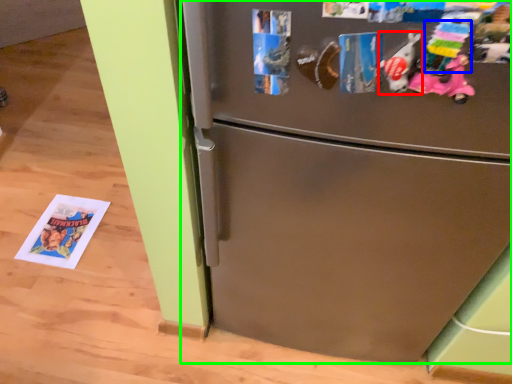
Question: Which object is the farthest from toy (highlighted by a red box)? Choose among these: toy (highlighted by a blue box) or refrigerator (highlighted by a green box).

Choices:
 (A) toy
 (B) refrigerator

Answer: (B)